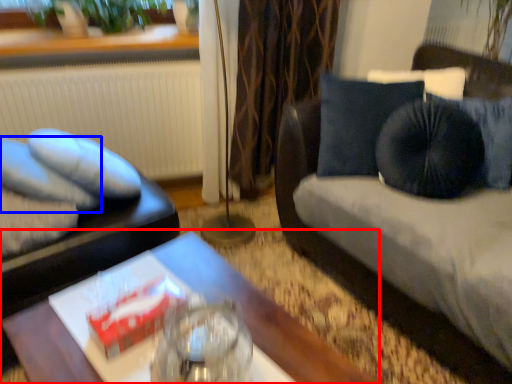
Question: Which object appears farthest to the camera in this image, table (highlighted by a red box) or pillow (highlighted by a blue box)?

Choices:
 (A) table
 (B) pillow

Answer: (B)